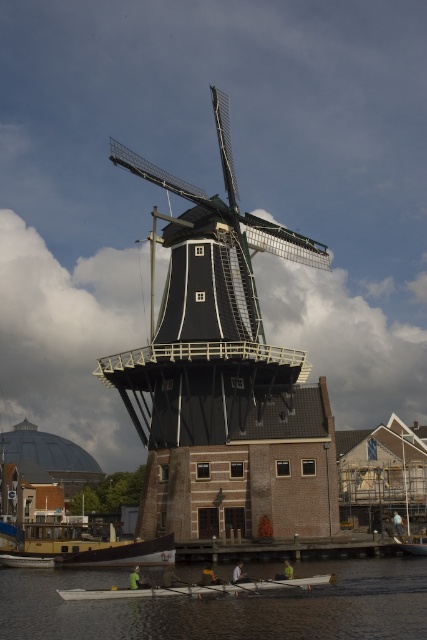
Can you confirm if black wooden windmill at center is bigger than transparent water at lower center?

Yes.

Between point (180, 186) and point (365, 596), which one is positioned in front?

Point (365, 596) is in front.

Does point (242, 284) lie behind point (0, 605)?

Yes, point (242, 284) is behind point (0, 605).

Where is `black wooden windmill at center`? The height and width of the screenshot is (640, 427). black wooden windmill at center is located at coordinates (207, 314).

Who is more forward, (268, 557) or (324, 579)?

Point (324, 579) is in front.

Between point (211, 540) and point (239, 593), which one is positioned behind?

The point (211, 540) is more distant.

Identify the location of brown wooden dock at lower center. (286, 548).

Between black wooden windmill at center and brown wooden dock at lower center, which one is positioned higher?

black wooden windmill at center is higher up.

Who is positioned more to the left, black wooden windmill at center or brown wooden dock at lower center?

black wooden windmill at center

Who is more distant from viewer, [180,436] or [278,548]?

The point [180,436] is behind.

At what (x,y) coordinates should I click in order to perform the action: click on black wooden windmill at center. Please return your answer as a coordinate pair (x, y). The height and width of the screenshot is (640, 427). Looking at the image, I should click on (207, 314).